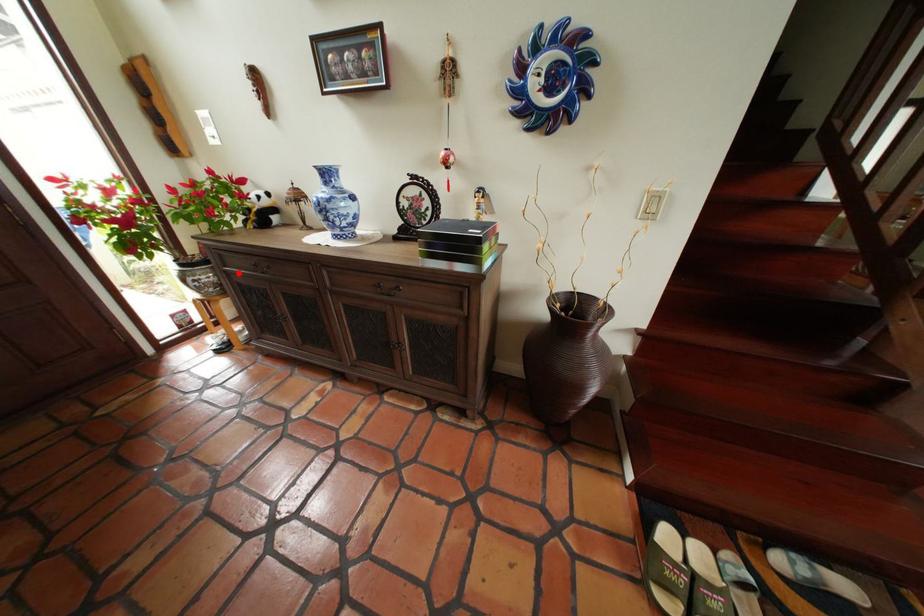
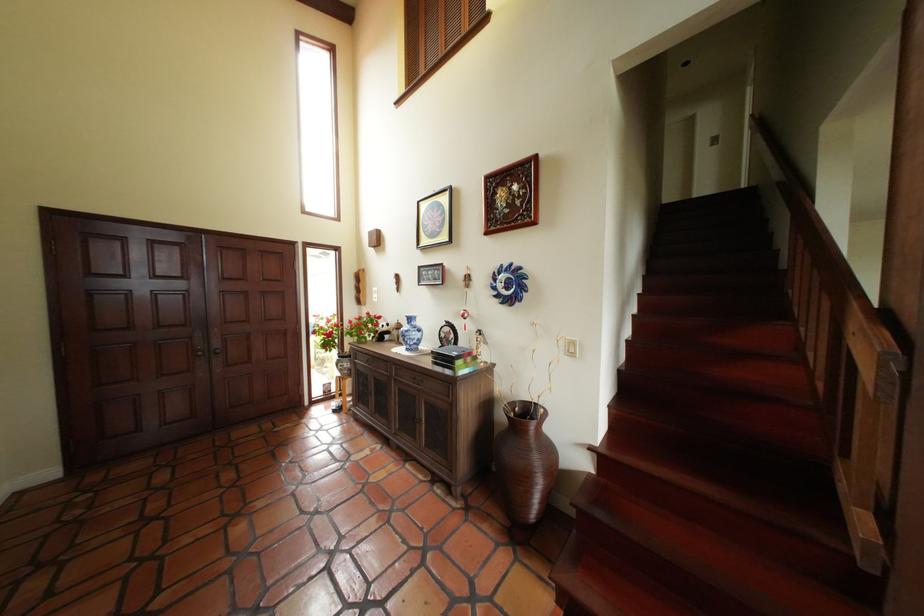
The point at the highlighted location is marked in the first image. Where is the corresponding point in the second image?

(368, 363)